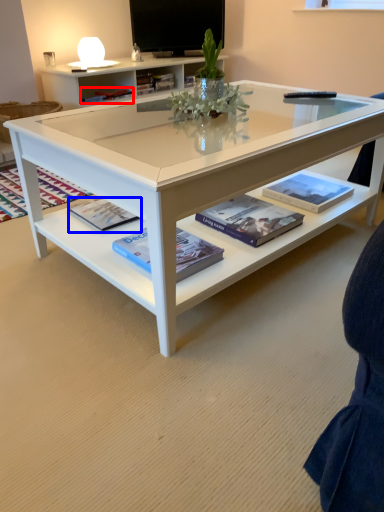
Question: Which object is further to the camera taking this photo, book (highlighted by a red box) or paperback book (highlighted by a blue box)?

Choices:
 (A) book
 (B) paperback book

Answer: (A)